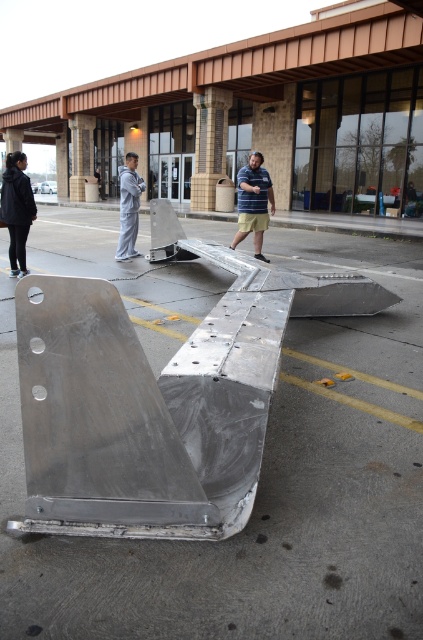
You are a delivery person with a cart that is 2 meters wide. You need to move from the silver metallic ramp at center to the gray fabric pants at center. Is there enough space between them for your cart to pass through?

The silver metallic ramp at center is 4.20 meters away from the gray fabric pants at center. Since your cart is 2 meters wide, there is sufficient space between them for your cart to pass through safely.

You are standing at the base of the building in the background and want to walk to the large metallic object. Which point, point (x=139, y=628) or point (x=27, y=200), is closer to you?

Point (x=139, y=628) is closer to the viewer than point (x=27, y=200), so you should head towards point (x=139, y=628).

You are a delivery person trying to place a large package on the silver metallic ramp at center. The package is as wide as the striped shirt at center. Can the package fit on the ramp?

The silver metallic ramp at center might be wider than striped shirt at center, so the package, which is as wide as the striped shirt at center, should fit on the ramp.